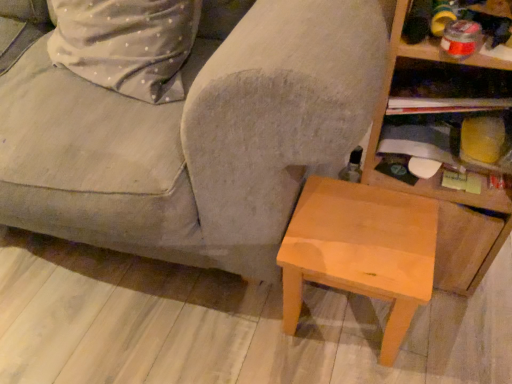
The image size is (512, 384). Find the location of `wooden shelf at upper right, marked as the 2th shelf in a bottom-to-top arrangement`. wooden shelf at upper right, marked as the 2th shelf in a bottom-to-top arrangement is located at coordinates (447, 88).

This screenshot has height=384, width=512. What are the coordinates of `light brown wood stool at lower right` in the screenshot? It's located at (361, 251).

Measure the distance between point (447, 217) and camera.

The depth of point (447, 217) is 34.92 inches.

The width and height of the screenshot is (512, 384). I want to click on wooden shelf at upper right, marked as the 2th shelf in a bottom-to-top arrangement, so click(x=447, y=88).

In the scene shown: Which of these two, wooden at right, the first shelf when ordered from bottom to top, or light brown wood stool at lower right, stands taller?

With more height is wooden at right, the first shelf when ordered from bottom to top.

From a real-world perspective, relative to light brown wood stool at lower right, is wooden at right, positioned as the second shelf in top-to-bottom order, vertically above or below?

A: wooden at right, positioned as the second shelf in top-to-bottom order, is above light brown wood stool at lower right.

How many degrees apart are the facing directions of wooden at right, the first shelf when ordered from bottom to top, and light brown wood stool at lower right?

They differ by 0.000428 degrees in their facing directions.

Considering the relative sizes of wooden at right, the first shelf when ordered from bottom to top, and light brown wood stool at lower right in the image provided, is wooden at right, the first shelf when ordered from bottom to top, smaller than light brown wood stool at lower right?

No, wooden at right, the first shelf when ordered from bottom to top, is not smaller than light brown wood stool at lower right.

Based on the photo, is light brown wood stool at lower right positioned in front of wooden shelf at upper right, marked as the 2th shelf in a bottom-to-top arrangement?

Yes, light brown wood stool at lower right is in front of wooden shelf at upper right, marked as the 2th shelf in a bottom-to-top arrangement.

Is light brown wood stool at lower right surrounding wooden shelf at upper right, the 1th shelf positioned from the top?

That's incorrect, wooden shelf at upper right, the 1th shelf positioned from the top, is not inside light brown wood stool at lower right.

The image size is (512, 384). Find the location of `shelf lying behind the light brown wood stool at lower right`. shelf lying behind the light brown wood stool at lower right is located at coordinates (447, 88).

Are light brown wood stool at lower right and wooden shelf at upper right, the 1th shelf positioned from the top, beside each other?

They are not placed beside each other.

What's the angular difference between light brown wood stool at lower right and gray fabric couch at center's facing directions?

light brown wood stool at lower right and gray fabric couch at center are facing 3 degrees away from each other.

Is light brown wood stool at lower right in contact with gray fabric couch at center?

No, light brown wood stool at lower right is not making contact with gray fabric couch at center.

From a real-world perspective, is light brown wood stool at lower right located higher than gray fabric couch at center?

No, from a real-world perspective, light brown wood stool at lower right is not above gray fabric couch at center.

Who is taller, light brown wood stool at lower right or gray fabric couch at center?

gray fabric couch at center is taller.

Considering the sizes of wooden at right, positioned as the second shelf in top-to-bottom order, and wooden shelf at upper right, marked as the 2th shelf in a bottom-to-top arrangement, in the image, is wooden at right, positioned as the second shelf in top-to-bottom order, bigger or smaller than wooden shelf at upper right, marked as the 2th shelf in a bottom-to-top arrangement,?

In the image, wooden at right, positioned as the second shelf in top-to-bottom order, appears to be larger than wooden shelf at upper right, marked as the 2th shelf in a bottom-to-top arrangement.

Does wooden at right, positioned as the second shelf in top-to-bottom order, appear on the right side of wooden shelf at upper right, the 1th shelf positioned from the top?

In fact, wooden at right, positioned as the second shelf in top-to-bottom order, is to the left of wooden shelf at upper right, the 1th shelf positioned from the top.

From a real-world perspective, is wooden at right, the first shelf when ordered from bottom to top, positioned above or below wooden shelf at upper right, marked as the 2th shelf in a bottom-to-top arrangement?

From a real-world perspective, wooden at right, the first shelf when ordered from bottom to top, is physically below wooden shelf at upper right, marked as the 2th shelf in a bottom-to-top arrangement.

Considering the positions of point (158, 228) and point (458, 87), is point (158, 228) closer or farther from the camera than point (458, 87)?

Point (158, 228).

Looking at this image, is gray fabric couch at center oriented away from wooden shelf at upper right, marked as the 2th shelf in a bottom-to-top arrangement?

No, gray fabric couch at center's orientation is not away from wooden shelf at upper right, marked as the 2th shelf in a bottom-to-top arrangement.

Is gray fabric couch at center not close to wooden shelf at upper right, the 1th shelf positioned from the top?

gray fabric couch at center is actually quite close to wooden shelf at upper right, the 1th shelf positioned from the top.

The height and width of the screenshot is (384, 512). I want to click on the 2nd shelf behind the gray fabric couch at center, starting your count from the anchor, so point(447,88).

Between wooden shelf at upper right, marked as the 2th shelf in a bottom-to-top arrangement, and wooden at right, positioned as the second shelf in top-to-bottom order, which one has larger size?

wooden at right, positioned as the second shelf in top-to-bottom order, is bigger.

Which is in front, point (467, 102) or point (450, 207)?

The point (467, 102) is closer.

Considering the relative positions of wooden shelf at upper right, marked as the 2th shelf in a bottom-to-top arrangement, and wooden at right, the first shelf when ordered from bottom to top, in the image provided, is wooden shelf at upper right, marked as the 2th shelf in a bottom-to-top arrangement, to the left of wooden at right, the first shelf when ordered from bottom to top, from the viewer's perspective?

Incorrect, wooden shelf at upper right, marked as the 2th shelf in a bottom-to-top arrangement, is not on the left side of wooden at right, the first shelf when ordered from bottom to top.

Is wooden shelf at upper right, the 1th shelf positioned from the top, positioned with its back to wooden at right, positioned as the second shelf in top-to-bottom order?

Absolutely, wooden shelf at upper right, the 1th shelf positioned from the top, is directed away from wooden at right, positioned as the second shelf in top-to-bottom order.

Based on the photo, is the position of wooden shelf at upper right, the 1th shelf positioned from the top, less distant than that of light brown wood stool at lower right?

No, wooden shelf at upper right, the 1th shelf positioned from the top, is further to the viewer.

How much distance is there between wooden shelf at upper right, the 1th shelf positioned from the top, and light brown wood stool at lower right?

wooden shelf at upper right, the 1th shelf positioned from the top, is 29.52 centimeters from light brown wood stool at lower right.

The height and width of the screenshot is (384, 512). I want to click on the 2nd shelf positioned above the light brown wood stool at lower right (from a real-world perspective), so click(447, 88).

Considering the relative sizes of wooden shelf at upper right, the 1th shelf positioned from the top, and light brown wood stool at lower right in the image provided, is wooden shelf at upper right, the 1th shelf positioned from the top, thinner than light brown wood stool at lower right?

Correct, the width of wooden shelf at upper right, the 1th shelf positioned from the top, is less than that of light brown wood stool at lower right.

Where is `table below the wooden at right, positioned as the second shelf in top-to-bottom order (from the image's perspective)`? This screenshot has height=384, width=512. table below the wooden at right, positioned as the second shelf in top-to-bottom order (from the image's perspective) is located at coordinates (361, 251).

Find the location of `table on the left of wooden shelf at upper right, marked as the 2th shelf in a bottom-to-top arrangement`. table on the left of wooden shelf at upper right, marked as the 2th shelf in a bottom-to-top arrangement is located at coordinates (361, 251).

Based on their spatial positions, is wooden shelf at upper right, the 1th shelf positioned from the top, or wooden at right, positioned as the second shelf in top-to-bottom order, closer to light brown wood stool at lower right?

The object closer to light brown wood stool at lower right is wooden at right, positioned as the second shelf in top-to-bottom order.

Estimate the real-world distances between objects in this image. Which object is closer to gray fabric couch at center, wooden at right, the first shelf when ordered from bottom to top, or wooden shelf at upper right, marked as the 2th shelf in a bottom-to-top arrangement?

wooden at right, the first shelf when ordered from bottom to top, is closer to gray fabric couch at center.

Based on their spatial positions, is light brown wood stool at lower right or wooden shelf at upper right, marked as the 2th shelf in a bottom-to-top arrangement, closer to gray fabric couch at center?

Based on the image, light brown wood stool at lower right appears to be nearer to gray fabric couch at center.

Considering their positions, is wooden at right, positioned as the second shelf in top-to-bottom order, positioned further to light brown wood stool at lower right than wooden shelf at upper right, marked as the 2th shelf in a bottom-to-top arrangement?

wooden shelf at upper right, marked as the 2th shelf in a bottom-to-top arrangement, lies further to light brown wood stool at lower right than the other object.

Considering their positions, is wooden at right, the first shelf when ordered from bottom to top, positioned closer to wooden shelf at upper right, marked as the 2th shelf in a bottom-to-top arrangement, than light brown wood stool at lower right?

wooden at right, the first shelf when ordered from bottom to top.

Which object lies nearer to the anchor point light brown wood stool at lower right, wooden shelf at upper right, the 1th shelf positioned from the top, or gray fabric couch at center?

gray fabric couch at center is positioned closer to the anchor light brown wood stool at lower right.

From the image, which object appears to be nearer to wooden at right, positioned as the second shelf in top-to-bottom order, light brown wood stool at lower right or gray fabric couch at center?

light brown wood stool at lower right is positioned closer to the anchor wooden at right, positioned as the second shelf in top-to-bottom order.

Estimate the real-world distances between objects in this image. Which object is further from gray fabric couch at center, wooden at right, positioned as the second shelf in top-to-bottom order, or light brown wood stool at lower right?

wooden at right, positioned as the second shelf in top-to-bottom order, is positioned further to the anchor gray fabric couch at center.

In order to click on table located between gray fabric couch at center and wooden shelf at upper right, marked as the 2th shelf in a bottom-to-top arrangement, in the left-right direction in this screenshot , I will do `click(361, 251)`.

Where is `shelf between wooden shelf at upper right, marked as the 2th shelf in a bottom-to-top arrangement, and light brown wood stool at lower right in the up-down direction`? The width and height of the screenshot is (512, 384). shelf between wooden shelf at upper right, marked as the 2th shelf in a bottom-to-top arrangement, and light brown wood stool at lower right in the up-down direction is located at coordinates (440, 187).

At what (x,y) coordinates should I click in order to perform the action: click on table situated between gray fabric couch at center and wooden at right, positioned as the second shelf in top-to-bottom order, from left to right. Please return your answer as a coordinate pair (x, y). Looking at the image, I should click on (361, 251).

Locate an element on the screen. This screenshot has height=384, width=512. shelf situated between gray fabric couch at center and wooden shelf at upper right, marked as the 2th shelf in a bottom-to-top arrangement, from left to right is located at coordinates (440, 187).